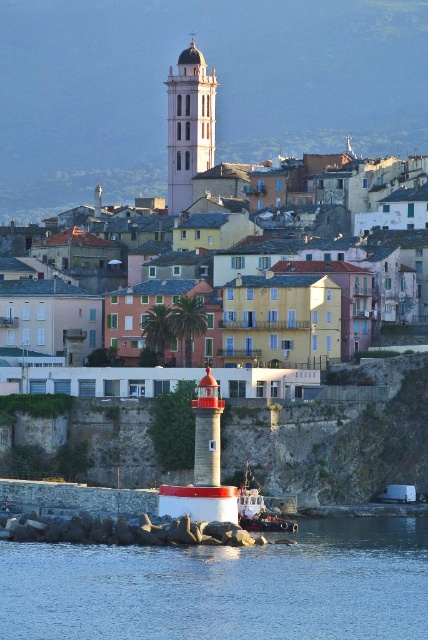
Based on the photo, you are a tourist standing at the edge of the jetty where the lighthouse is located. You want to take a photo of the white plastic boat at lower center and the matte pink building at upper center. Which object should you place on the left side of your photo to capture both in the frame?

To capture both the white plastic boat at lower center and the matte pink building at upper center in the frame, you should place the matte pink building at upper center on the left side of your photo since it is already positioned on the left side of the white plastic boat at lower center.